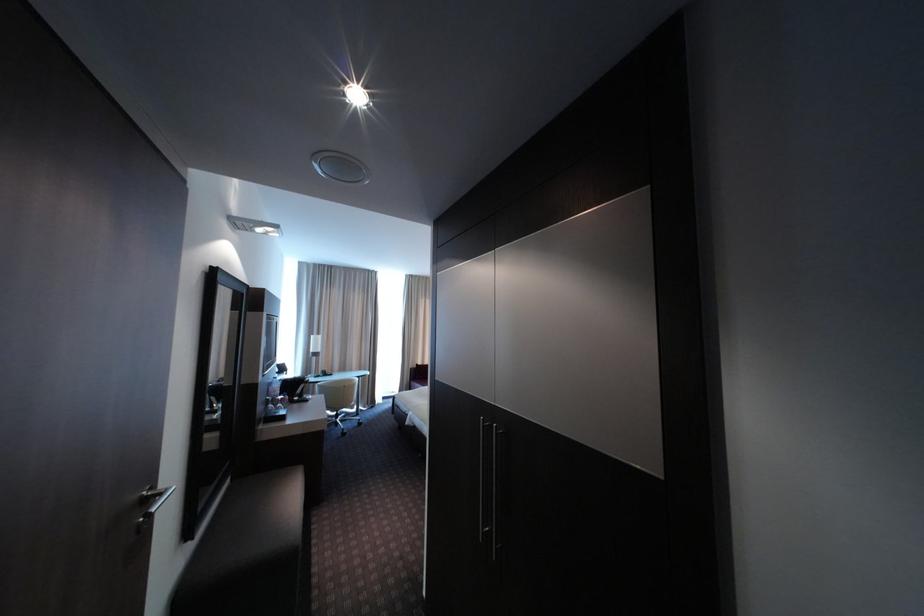
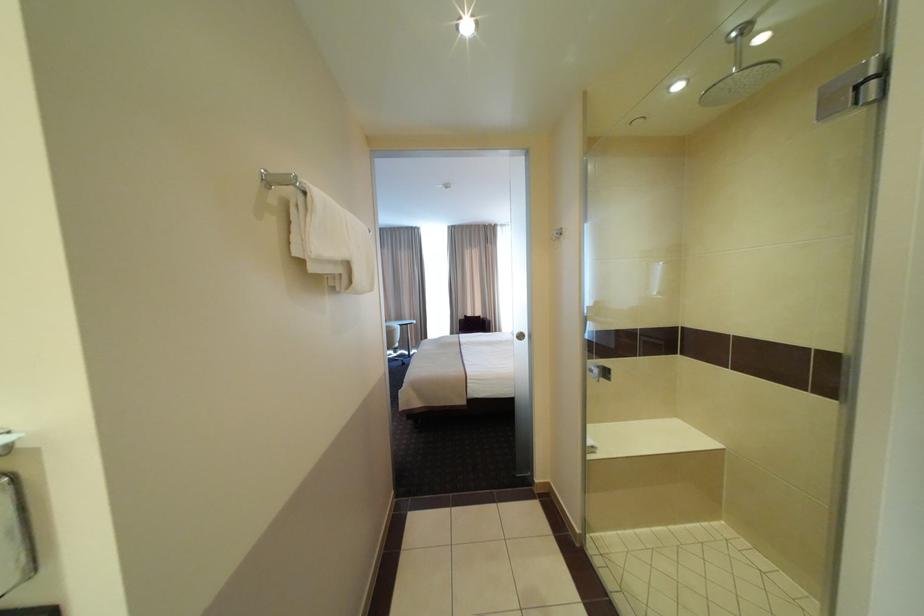
What movement of the cameraman would produce the second image?

The cameraman walked toward right, forward.